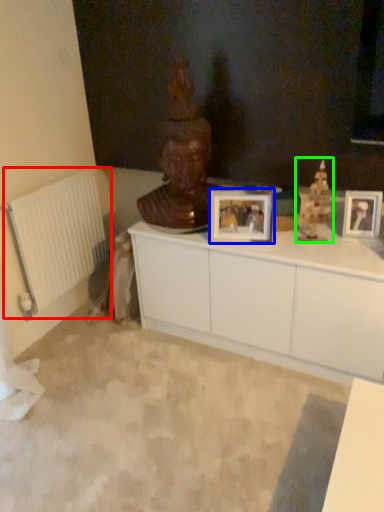
Question: Which object is positioned closest to radiator (highlighted by a red box)? Select from picture frame (highlighted by a blue box) and toy (highlighted by a green box).

Choices:
 (A) picture frame
 (B) toy

Answer: (A)